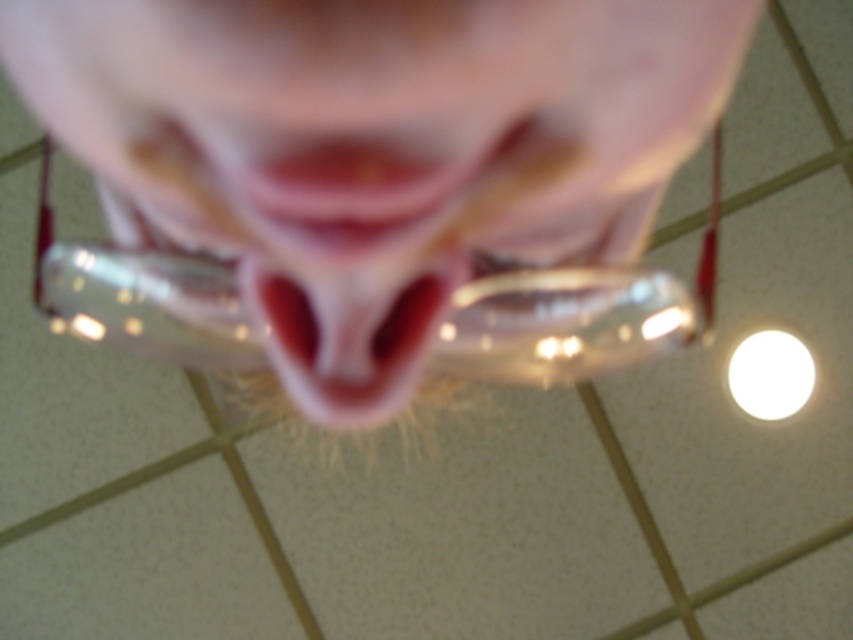
Question: Which of the following is the farthest from the observer?

Choices:
 (A) pink glossy lips at center
 (B) pink translucent glasses at center

Answer: (A)

Question: Can you confirm if pink translucent glasses at center is smaller than pink glossy lips at center?

Choices:
 (A) yes
 (B) no

Answer: (B)

Question: Which of the following is the farthest from the observer?

Choices:
 (A) pink translucent glasses at center
 (B) pink glossy lips at center

Answer: (B)

Question: Which point appears closest to the camera in this image?

Choices:
 (A) (635, 179)
 (B) (332, 241)

Answer: (B)

Question: Is the position of pink translucent glasses at center more distant than that of pink glossy lips at center?

Choices:
 (A) yes
 (B) no

Answer: (B)

Question: Is pink translucent glasses at center to the left of pink glossy lips at center from the viewer's perspective?

Choices:
 (A) yes
 (B) no

Answer: (B)